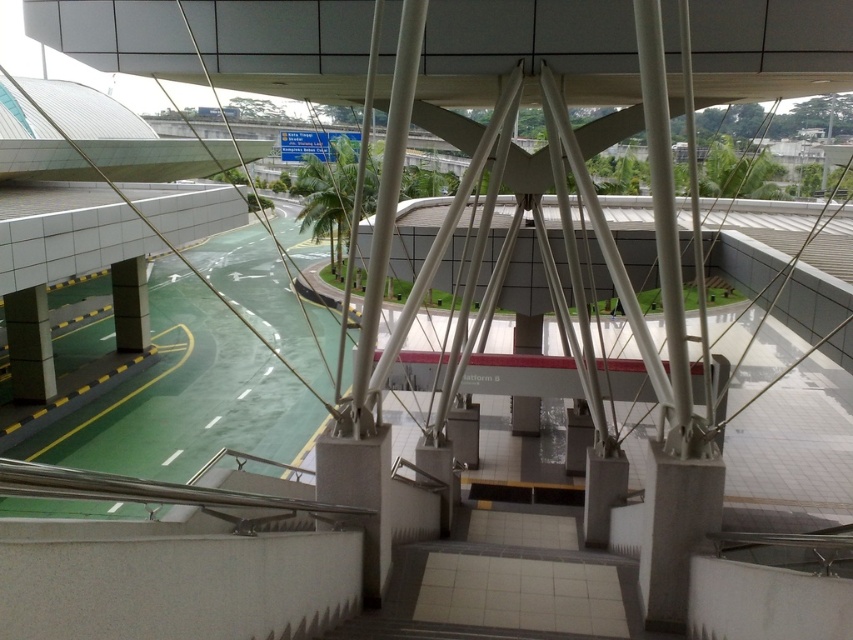
You are a maintenance worker needing to reach both the green leafy palm tree at center and the matte gray pillar at center. If your ladder is 60 feet long, can you use it to reach both objects from your current position?

The green leafy palm tree at center is 57.75 feet from the matte gray pillar at center. Since your ladder is 60 feet long, it is long enough to reach both objects from your current position as the distance between them is less than the ladder length.

You are standing at the top of the stairs in the train station and see the green leafy palm tree at center and the matte gray pillar at center. Which object would block your view more if you tried to look past them towards the platform area?

The green leafy palm tree at center would block your view more because it is larger in size than the matte gray pillar at center.